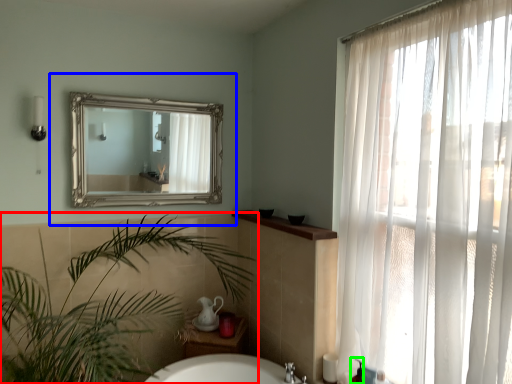
Question: Considering the real-world distances, which object is farthest from houseplant (highlighted by a red box)? medicine cabinet (highlighted by a blue box) or toiletry (highlighted by a green box)?

Choices:
 (A) medicine cabinet
 (B) toiletry

Answer: (B)